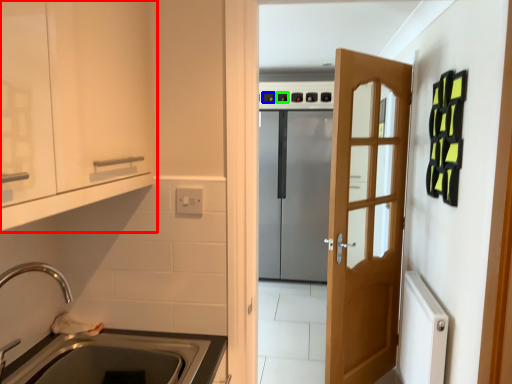
Question: Which object is positioned farthest from cabinetry (highlighted by a red box)? Select from knob (highlighted by a blue box) and knob (highlighted by a green box).

Choices:
 (A) knob
 (B) knob

Answer: (A)